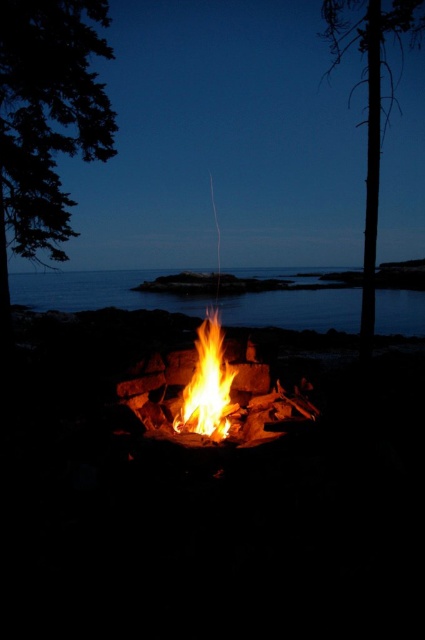
Between smooth bark tree at right and flamewoodenbonfire at center, which one is positioned lower?

Positioned lower is flamewoodenbonfire at center.

Image resolution: width=425 pixels, height=640 pixels. What do you see at coordinates (371, 100) in the screenshot?
I see `smooth bark tree at right` at bounding box center [371, 100].

The height and width of the screenshot is (640, 425). Find the location of `smooth bark tree at right`. smooth bark tree at right is located at coordinates (371, 100).

This screenshot has width=425, height=640. In order to click on flaming wood fire pit at center in this screenshot , I will do `click(214, 397)`.

Is flaming wood fire pit at center positioned in front of flamewoodenbonfire at center?

Yes.

Is point (218, 417) closer to viewer compared to point (220, 406)?

That is True.

This screenshot has height=640, width=425. In order to click on flaming wood fire pit at center in this screenshot , I will do `click(214, 397)`.

Is point (204, 436) farther from viewer compared to point (377, 12)?

No, (204, 436) is in front of (377, 12).

You are a GUI agent. You are given a task and a screenshot of the screen. Output one action in this format:
    pyautogui.click(x=<x>, y=<y>)
    Task: Click on the flaming wood fire pit at center
    
    Given the screenshot: What is the action you would take?
    pyautogui.click(x=214, y=397)